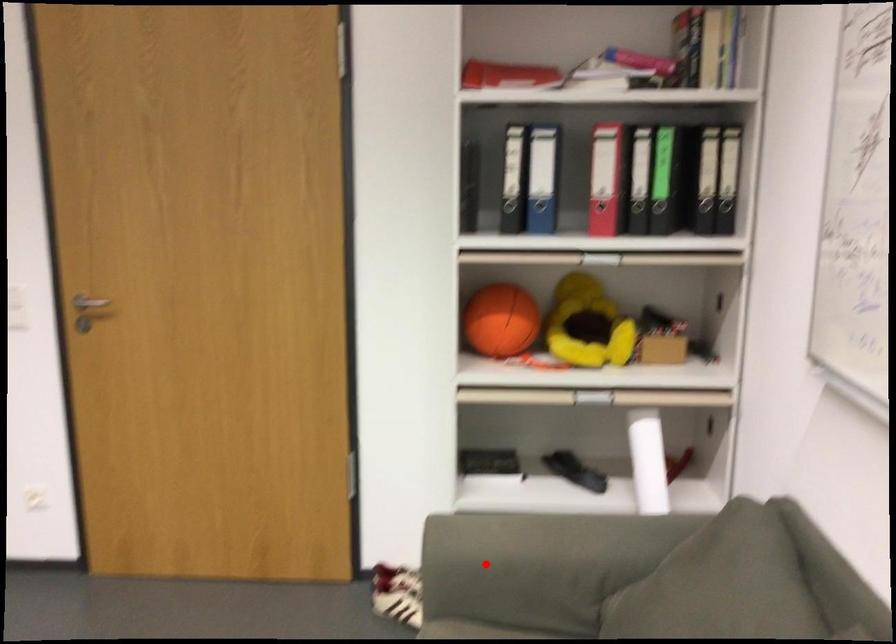
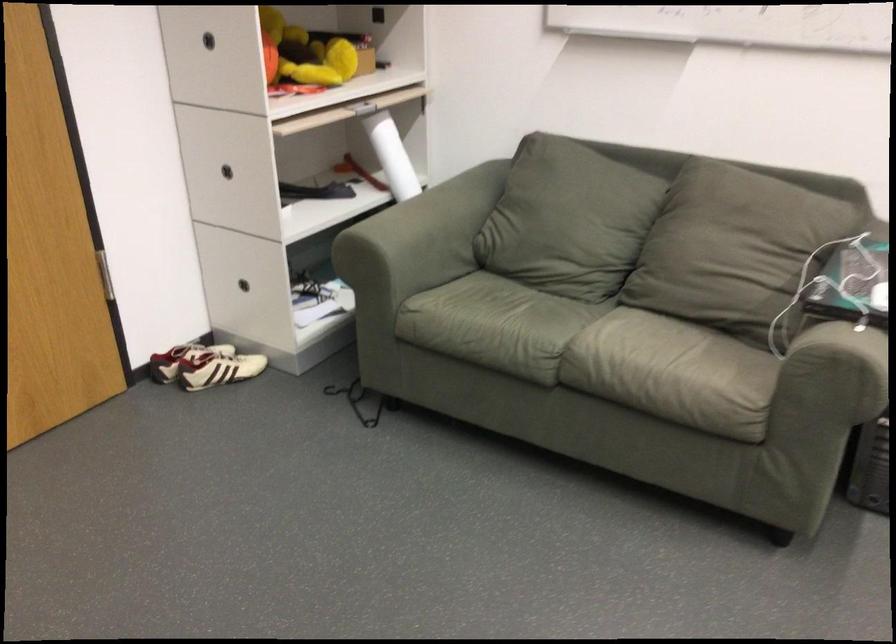
Where in the second image is the point corresponding to the highlighted location from the first image?

(416, 242)